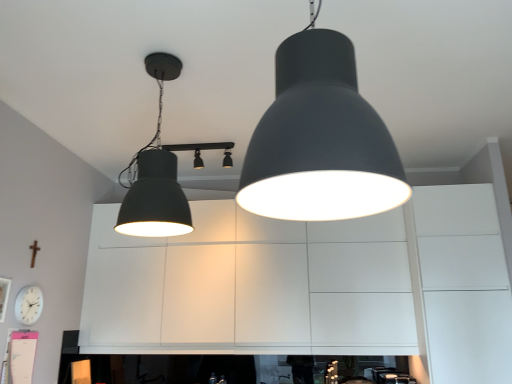
Question: Is white matte clock at lower left positioned beyond the bounds of matte black lampshade at center, the 3th lamp in the back-to-front sequence?

Choices:
 (A) yes
 (B) no

Answer: (A)

Question: Are white matte clock at lower left and matte black lampshade at center, the 3th lamp in the back-to-front sequence, far apart?

Choices:
 (A) no
 (B) yes

Answer: (B)

Question: Is white matte clock at lower left aimed at matte black lampshade at center, the 3th lamp in the back-to-front sequence?

Choices:
 (A) no
 (B) yes

Answer: (A)

Question: From a real-world perspective, is white matte clock at lower left physically above matte black lampshade at center, the 1th lamp from the front?

Choices:
 (A) no
 (B) yes

Answer: (A)

Question: Is white matte clock at lower left bigger than matte black lampshade at center, the 1th lamp from the front?

Choices:
 (A) yes
 (B) no

Answer: (B)

Question: Is matte black lampshade at upper left, which is counted as the second lamp, starting from the back, inside or outside of matte black spotlights at center, acting as the 3th lamp starting from the front?

Choices:
 (A) outside
 (B) inside

Answer: (A)

Question: Based on their sizes in the image, would you say matte black lampshade at upper left, which is the 2th lamp in front-to-back order, is bigger or smaller than matte black spotlights at center, acting as the 3th lamp starting from the front?

Choices:
 (A) big
 (B) small

Answer: (A)

Question: From a real-world perspective, is matte black lampshade at upper left, which is the 2th lamp in front-to-back order, positioned above or below matte black spotlights at center, marked as the first lamp in a back-to-front arrangement?

Choices:
 (A) below
 (B) above

Answer: (A)

Question: Is matte black lampshade at upper left, which is the 2th lamp in front-to-back order, taller or shorter than matte black spotlights at center, marked as the first lamp in a back-to-front arrangement?

Choices:
 (A) short
 (B) tall

Answer: (B)

Question: In terms of size, does matte black lampshade at upper left, which is the 2th lamp in front-to-back order, appear bigger or smaller than white matte clock at lower left?

Choices:
 (A) big
 (B) small

Answer: (A)

Question: Would you say matte black lampshade at upper left, which is the 2th lamp in front-to-back order, is to the left or to the right of white matte clock at lower left in the picture?

Choices:
 (A) left
 (B) right

Answer: (B)

Question: From the image's perspective, is matte black lampshade at upper left, which is counted as the second lamp, starting from the back, above or below white matte clock at lower left?

Choices:
 (A) above
 (B) below

Answer: (A)

Question: Is point (158, 215) positioned closer to the camera than point (33, 301)?

Choices:
 (A) closer
 (B) farther

Answer: (A)

Question: Looking at the image, does white matte clock at lower left seem bigger or smaller compared to matte black lampshade at center, the 3th lamp in the back-to-front sequence?

Choices:
 (A) big
 (B) small

Answer: (B)

Question: Is point (24, 296) closer or farther from the camera than point (350, 56)?

Choices:
 (A) farther
 (B) closer

Answer: (A)